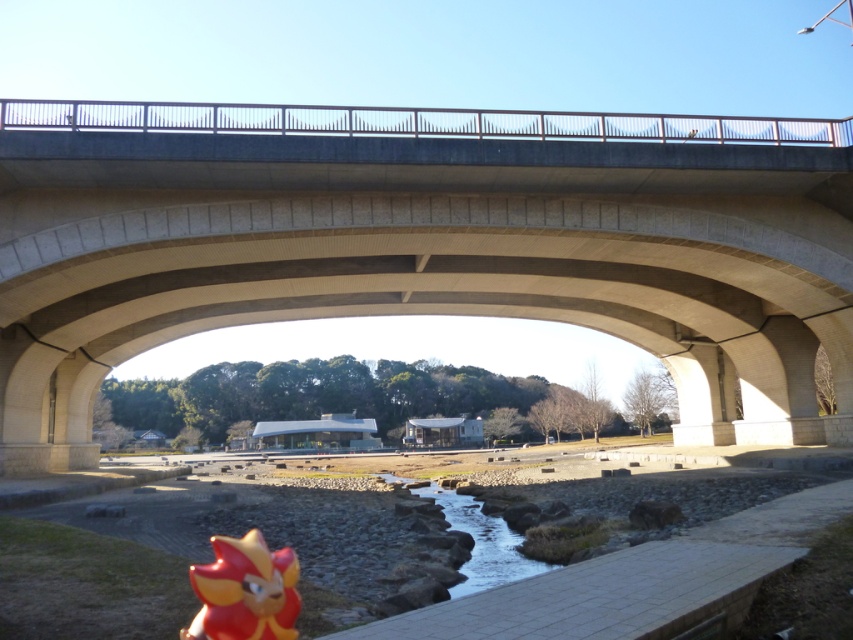
Can you confirm if concrete bridge at upper center is smaller than clear stone waterway at center?

Actually, concrete bridge at upper center might be larger than clear stone waterway at center.

Based on the photo, can you confirm if concrete bridge at upper center is positioned to the right of clear stone waterway at center?

Correct, you'll find concrete bridge at upper center to the right of clear stone waterway at center.

Between point (45, 193) and point (474, 577), which one is positioned behind?

Positioned behind is point (45, 193).

Locate an element on the screen. This screenshot has height=640, width=853. concrete bridge at upper center is located at coordinates (422, 244).

Which is below, shiny red plastic toy at lower left or clear stone waterway at center?

clear stone waterway at center is lower down.

Is shiny red plastic toy at lower left wider than clear stone waterway at center?

In fact, shiny red plastic toy at lower left might be narrower than clear stone waterway at center.

Describe the element at coordinates (244, 592) in the screenshot. Image resolution: width=853 pixels, height=640 pixels. I see `shiny red plastic toy at lower left` at that location.

In order to click on shiny red plastic toy at lower left in this screenshot , I will do `click(244, 592)`.

Which of these two, concrete bridge at upper center or shiny red plastic toy at lower left, stands taller?

With more height is concrete bridge at upper center.

Can you confirm if concrete bridge at upper center is thinner than shiny red plastic toy at lower left?

In fact, concrete bridge at upper center might be wider than shiny red plastic toy at lower left.

Between point (437, 172) and point (276, 600), which one is positioned behind?

Positioned behind is point (437, 172).

You are a GUI agent. You are given a task and a screenshot of the screen. Output one action in this format:
    pyautogui.click(x=<x>, y=<y>)
    Task: Click on the concrete bridge at upper center
    
    Given the screenshot: What is the action you would take?
    pyautogui.click(x=422, y=244)